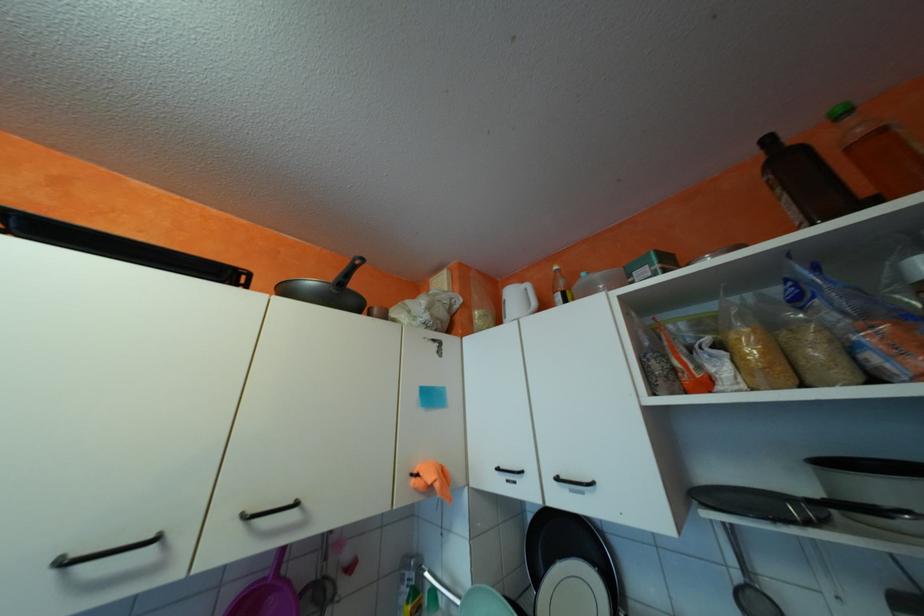
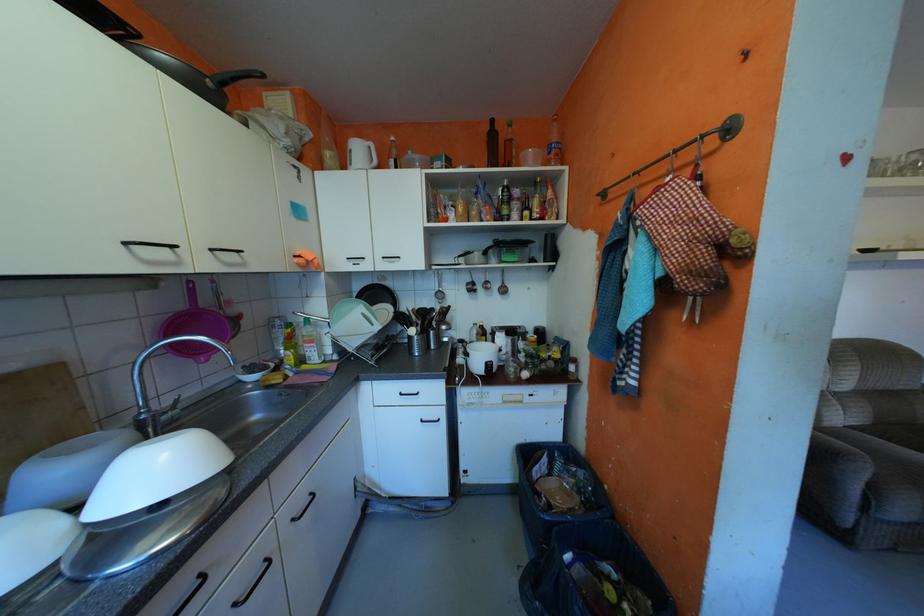
Based on the continuous images, in which direction is the camera rotating?

The camera rotated toward right-down.